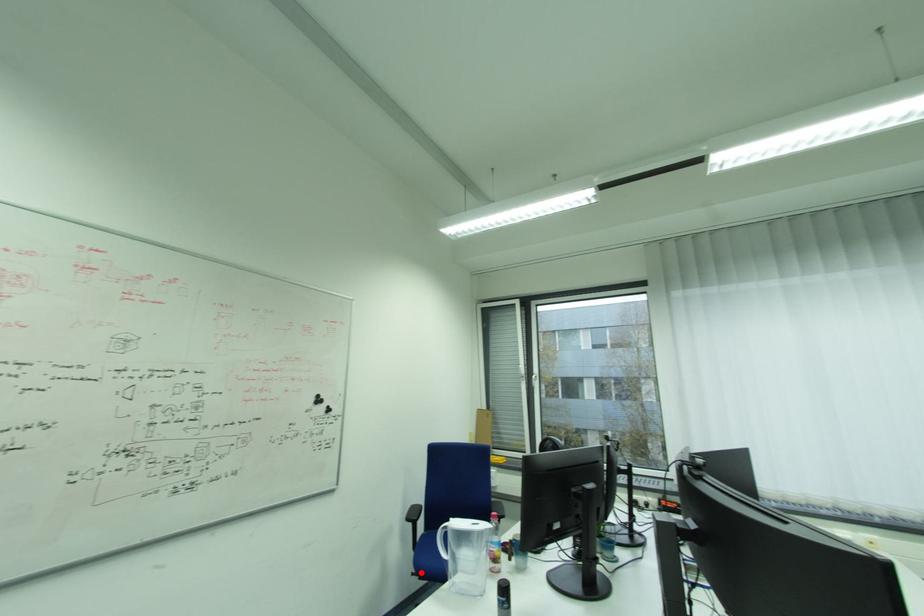
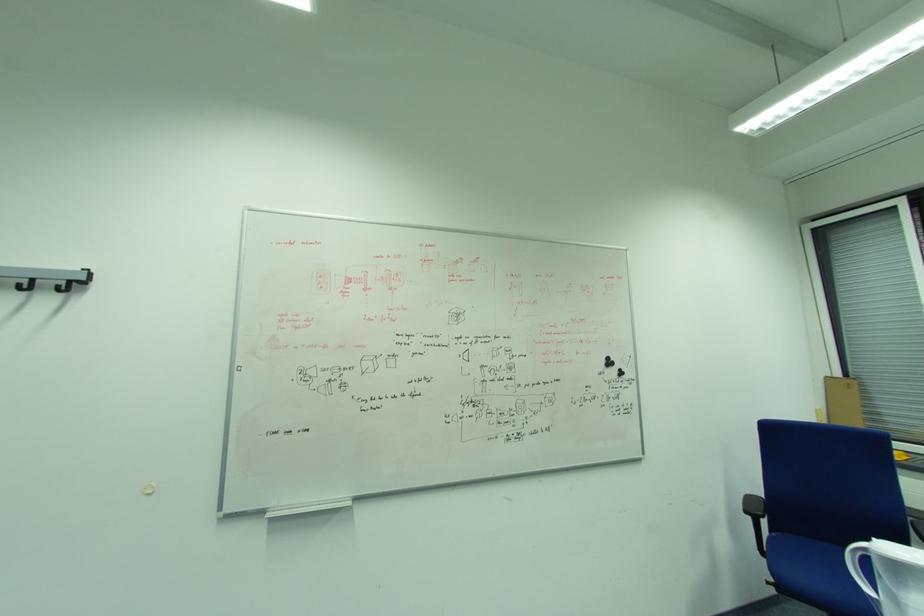
Question: A red point is marked in image1. In image2, is the corresponding 3D point closer to the camera or farther? Reply with the corresponding letter.

Choices:
 (A) The corresponding 3D point is closer.
 (B) The corresponding 3D point is farther.

Answer: (B)